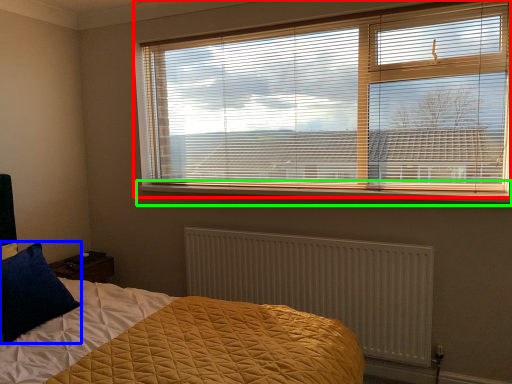
Question: Considering the real-world distances, which object is farthest from window blind (highlighted by a red box)? pillow (highlighted by a blue box) or window sill (highlighted by a green box)?

Choices:
 (A) pillow
 (B) window sill

Answer: (A)